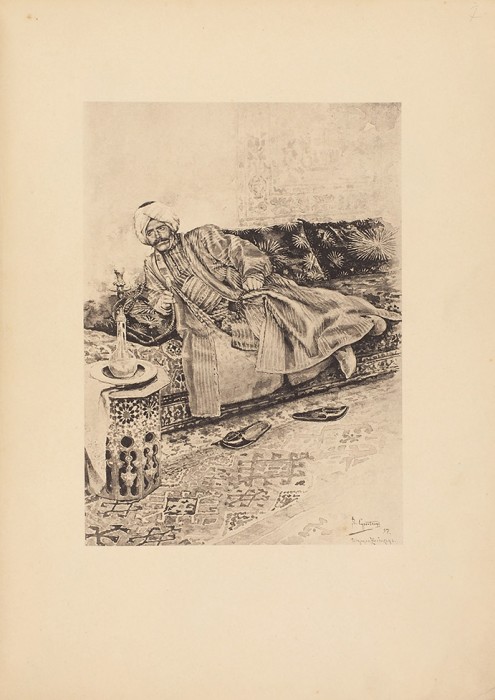
The image size is (495, 700). I want to click on persian style sofa artwork, so (373, 265), (382, 362), (166, 354).